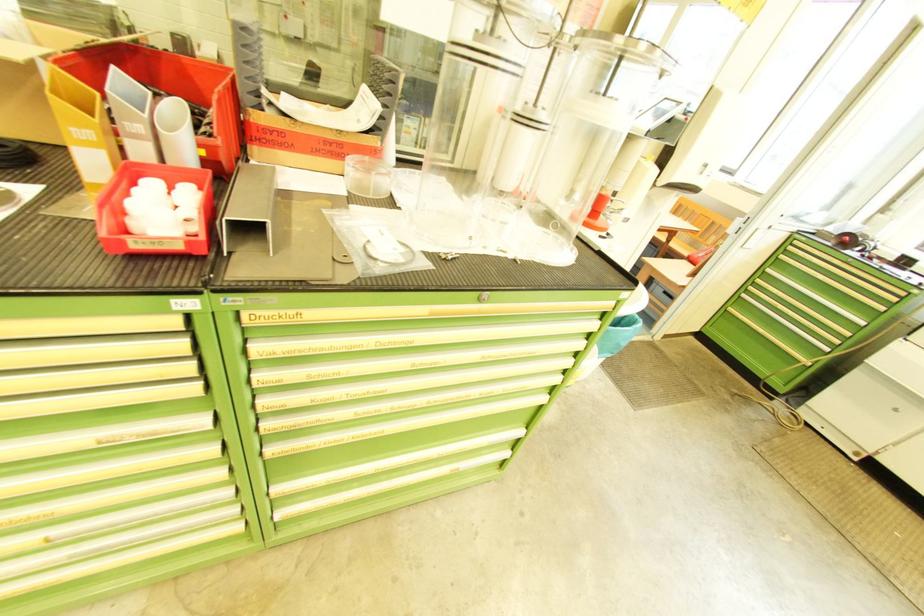
The location [82,128] corresponds to which object?

This point indicates the yellow file holder.